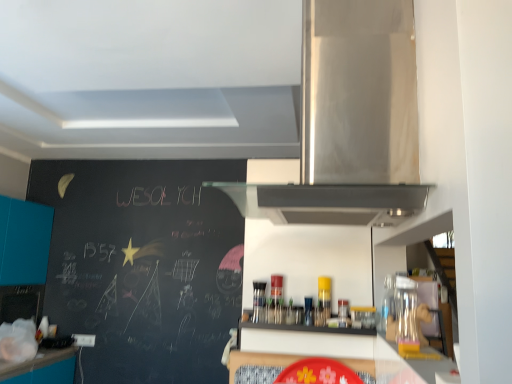
Question: Is teal matte cabinet at left completely or partially inside black matte shelf at center?

Choices:
 (A) yes
 (B) no

Answer: (B)

Question: From a real-world perspective, is black matte shelf at center on teal matte cabinet at left?

Choices:
 (A) no
 (B) yes

Answer: (A)

Question: From a real-world perspective, does black matte shelf at center sit lower than teal matte cabinet at left?

Choices:
 (A) no
 (B) yes

Answer: (B)

Question: Considering the relative sizes of black matte shelf at center and teal matte cabinet at left in the image provided, is black matte shelf at center taller than teal matte cabinet at left?

Choices:
 (A) yes
 (B) no

Answer: (B)

Question: Is black matte shelf at center wider than teal matte cabinet at left?

Choices:
 (A) no
 (B) yes

Answer: (A)

Question: Relative to stainless steel range hood at upper center, is teal matte cabinet at left in front or behind?

Choices:
 (A) front
 (B) behind

Answer: (B)

Question: From a real-world perspective, relative to stainless steel range hood at upper center, is teal matte cabinet at left vertically above or below?

Choices:
 (A) below
 (B) above

Answer: (A)

Question: In terms of height, does teal matte cabinet at left look taller or shorter compared to stainless steel range hood at upper center?

Choices:
 (A) short
 (B) tall

Answer: (B)

Question: From the image's perspective, relative to stainless steel range hood at upper center, is teal matte cabinet at left above or below?

Choices:
 (A) below
 (B) above

Answer: (A)

Question: Considering the positions of stainless steel range hood at upper center and black matte shelf at center in the image, is stainless steel range hood at upper center taller or shorter than black matte shelf at center?

Choices:
 (A) short
 (B) tall

Answer: (B)

Question: Looking at the image, does stainless steel range hood at upper center seem bigger or smaller compared to black matte shelf at center?

Choices:
 (A) big
 (B) small

Answer: (A)

Question: Is stainless steel range hood at upper center situated inside black matte shelf at center or outside?

Choices:
 (A) outside
 (B) inside

Answer: (A)

Question: Considering the relative positions of stainless steel range hood at upper center and black matte shelf at center in the image provided, is stainless steel range hood at upper center to the left or to the right of black matte shelf at center?

Choices:
 (A) left
 (B) right

Answer: (A)

Question: From a real-world perspective, is stainless steel range hood at upper center above or below teal matte cabinet at left?

Choices:
 (A) below
 (B) above

Answer: (B)

Question: From the image's perspective, relative to teal matte cabinet at left, is stainless steel range hood at upper center above or below?

Choices:
 (A) below
 (B) above

Answer: (B)